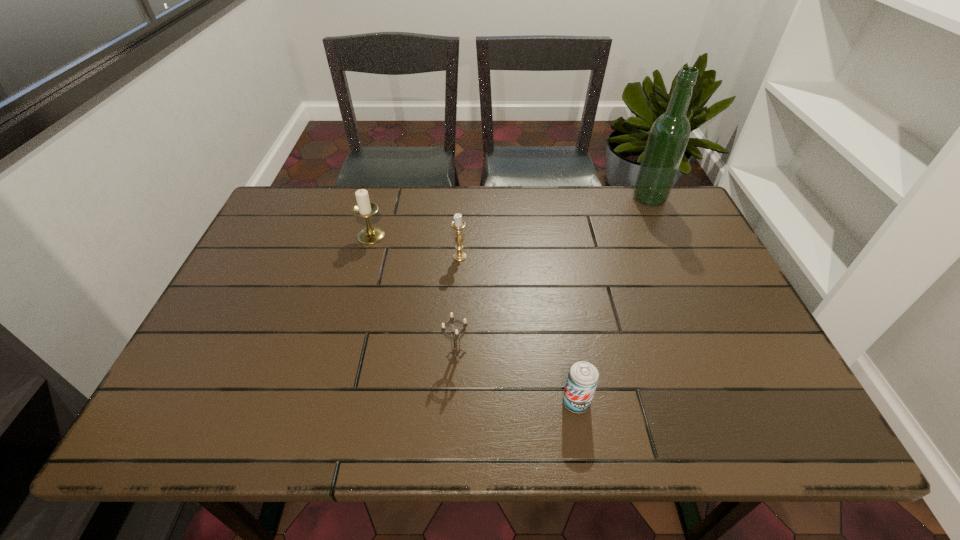
Where is `free space at the near edge of the desktop`? This screenshot has width=960, height=540. free space at the near edge of the desktop is located at coordinates (411, 429).

The height and width of the screenshot is (540, 960). In the image, there is a desktop. Identify the location of vacant space at the left edge. (177, 388).

The image size is (960, 540). In the image, there is a desktop. What are the coordinates of `free space at the right edge` in the screenshot? It's located at (680, 298).

The image size is (960, 540). In the image, there is a desktop. In order to click on free space at the far left corner in this screenshot , I will do `click(324, 194)`.

The height and width of the screenshot is (540, 960). In the image, there is a desktop. Find the location of `vacant region at the near left corner`. vacant region at the near left corner is located at coordinates (218, 440).

At what (x,y) coordinates should I click in order to perform the action: click on free region at the near right corner. Please return your answer as a coordinate pair (x, y). Looking at the image, I should click on (768, 407).

This screenshot has width=960, height=540. In order to click on empty space that is in between the second object from right to left and the third nearest object in this screenshot , I will do `click(518, 329)`.

Where is `vacant space in between the third nearest object and the farthest object`? The image size is (960, 540). vacant space in between the third nearest object and the farthest object is located at coordinates (555, 227).

You are a GUI agent. You are given a task and a screenshot of the screen. Output one action in this format:
    pyautogui.click(x=<x>, y=<y>)
    Task: Click on the free space between the shortest candle holder and the third nearest object
    This screenshot has width=960, height=540.
    Given the screenshot: What is the action you would take?
    pyautogui.click(x=458, y=306)

Identify the location of blank region between the fourth farthest object and the leftmost object. (414, 295).